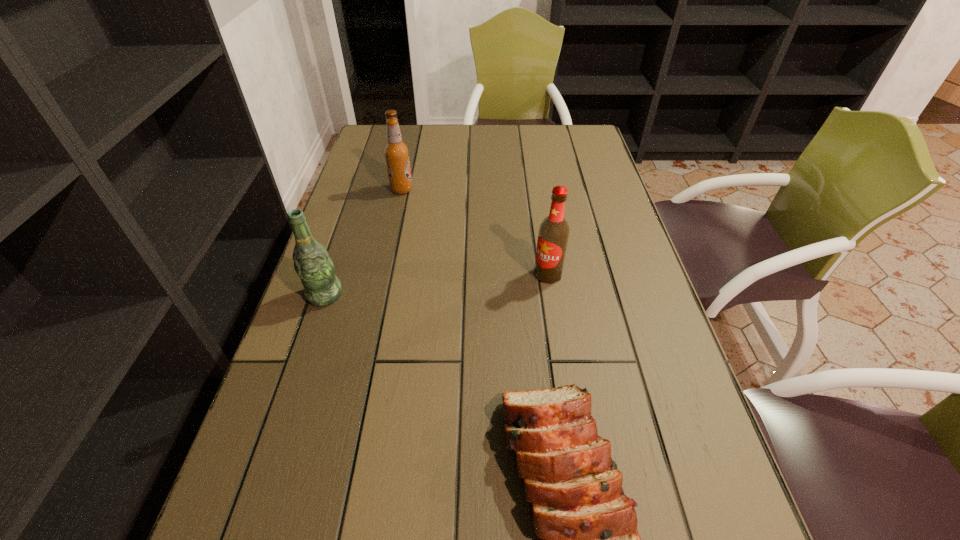
Find the location of a particular element. Image resolution: width=960 pixels, height=540 pixels. the farthest beer bottle is located at coordinates (396, 152).

Where is `the third object from right to left`? This screenshot has height=540, width=960. the third object from right to left is located at coordinates (396, 152).

At what (x,y) coordinates should I click in order to perform the action: click on the rightmost beer bottle. Please return your answer as a coordinate pair (x, y). The width and height of the screenshot is (960, 540). Looking at the image, I should click on (553, 234).

Image resolution: width=960 pixels, height=540 pixels. I want to click on the leftmost object, so click(312, 263).

Locate an element on the screen. blank area located 0.250m on the front label of the third object from right to left is located at coordinates (497, 190).

This screenshot has height=540, width=960. I want to click on free location located on the left of the rightmost beer bottle, so click(446, 274).

You are a GUI agent. You are given a task and a screenshot of the screen. Output one action in this format:
    pyautogui.click(x=<x>, y=<y>)
    Task: Click on the blank space located on the surface of the leftmost object
    This screenshot has width=960, height=540.
    Given the screenshot: What is the action you would take?
    pyautogui.click(x=286, y=411)

The image size is (960, 540). Identify the location of free location at the far edge of the desktop. (418, 144).

Image resolution: width=960 pixels, height=540 pixels. What are the coordinates of `free point at the left edge` in the screenshot? It's located at (224, 523).

The width and height of the screenshot is (960, 540). In the image, there is a desktop. What are the coordinates of `vacant space at the right edge` in the screenshot? It's located at (x=617, y=217).